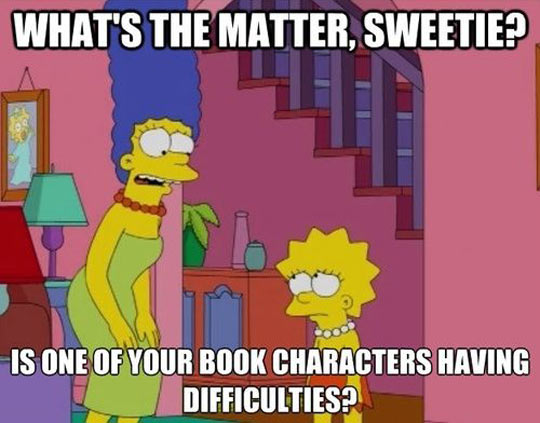
What are the coordinates of `vase` in the screenshot? It's located at (244, 242).